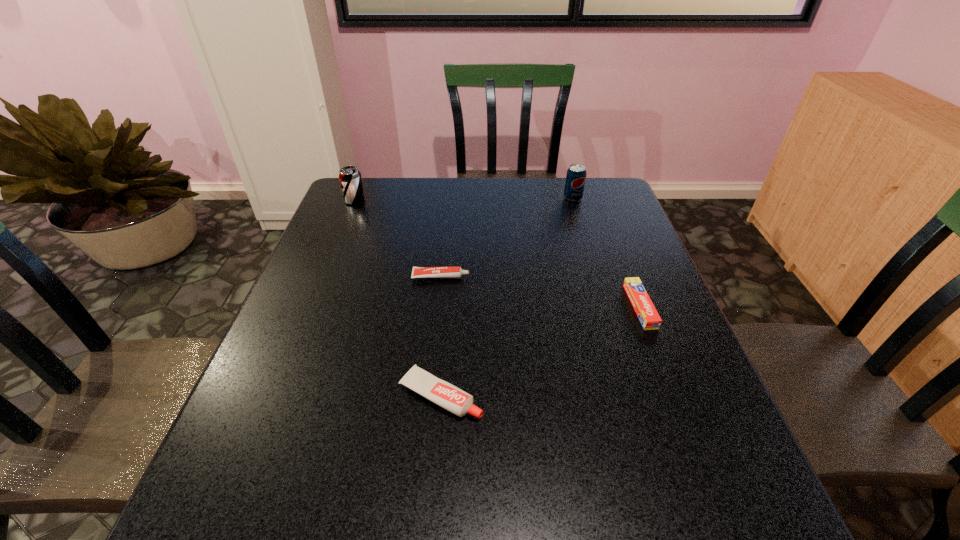
The height and width of the screenshot is (540, 960). I want to click on the right soda can, so click(x=576, y=174).

This screenshot has width=960, height=540. I want to click on the leftmost object, so click(x=350, y=178).

You are a GUI agent. You are given a task and a screenshot of the screen. Output one action in this format:
    pyautogui.click(x=<x>, y=<y>)
    Task: Click on the third shortest object
    The height and width of the screenshot is (540, 960).
    Given the screenshot: What is the action you would take?
    pyautogui.click(x=442, y=393)

Where is `the nearest toothpaste`? This screenshot has width=960, height=540. the nearest toothpaste is located at coordinates 442,393.

This screenshot has width=960, height=540. What are the coordinates of `the farthest toothpaste` in the screenshot? It's located at pyautogui.click(x=418, y=272).

The width and height of the screenshot is (960, 540). I want to click on the second farthest toothpaste, so click(650, 320).

Image resolution: width=960 pixels, height=540 pixels. In order to click on the rightmost toothpaste in this screenshot , I will do coord(650,320).

Where is `free location located on the front of the right soda can`? This screenshot has height=540, width=960. free location located on the front of the right soda can is located at coordinates (583, 232).

Image resolution: width=960 pixels, height=540 pixels. Find the location of `vacant region located on the front of the left soda can`. vacant region located on the front of the left soda can is located at coordinates (329, 264).

This screenshot has height=540, width=960. I want to click on vacant space situated 0.300m on the left of the third shortest object, so click(247, 395).